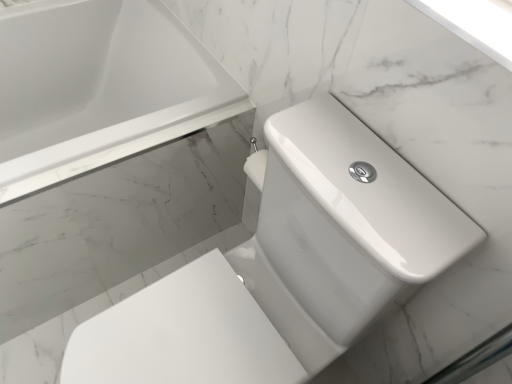
Question: Considering the relative positions of white glossy bathtub at upper left and white glossy toilet at center-right in the image provided, is white glossy bathtub at upper left to the left or to the right of white glossy toilet at center-right?

Choices:
 (A) left
 (B) right

Answer: (A)

Question: From a real-world perspective, is white glossy bathtub at upper left physically located above or below white glossy toilet at center-right?

Choices:
 (A) above
 (B) below

Answer: (B)

Question: Considering the positions of point (178, 49) and point (352, 297), is point (178, 49) closer or farther from the camera than point (352, 297)?

Choices:
 (A) farther
 (B) closer

Answer: (A)

Question: From a real-world perspective, is white glossy toilet at center-right positioned above or below white glossy bathtub at upper left?

Choices:
 (A) below
 (B) above

Answer: (B)

Question: Considering the positions of white glossy toilet at center-right and white glossy bathtub at upper left in the image, is white glossy toilet at center-right bigger or smaller than white glossy bathtub at upper left?

Choices:
 (A) small
 (B) big

Answer: (A)

Question: In terms of height, does white glossy toilet at center-right look taller or shorter compared to white glossy bathtub at upper left?

Choices:
 (A) tall
 (B) short

Answer: (A)

Question: Relative to white glossy bathtub at upper left, is white glossy toilet at center-right in front or behind?

Choices:
 (A) behind
 (B) front

Answer: (B)